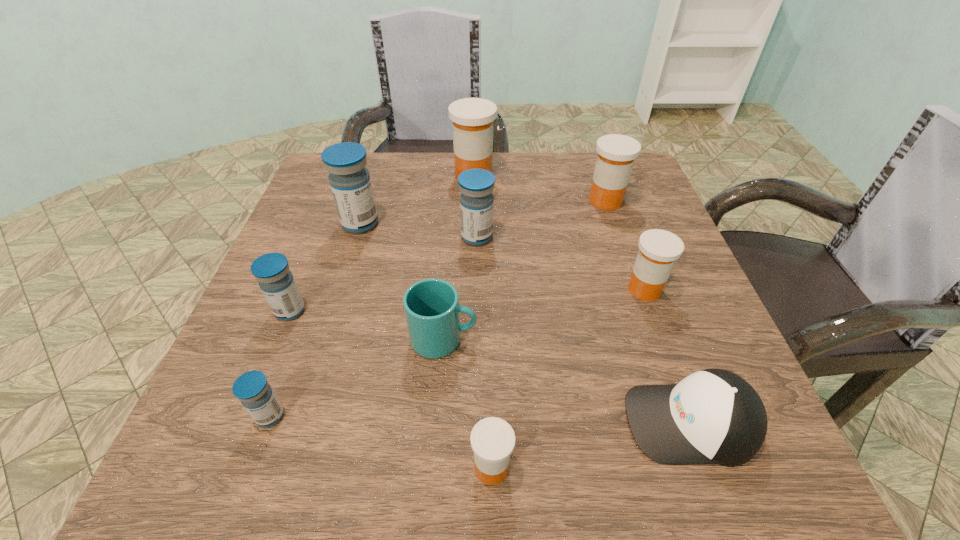
Image resolution: width=960 pixels, height=540 pixels. Find the location of `vacant space at the far left corner of the desktop`. vacant space at the far left corner of the desktop is located at coordinates (374, 176).

This screenshot has height=540, width=960. In the image, there is a desktop. Identify the location of vacant area at the near left corner. (239, 449).

Where is `free point at the far right corner`? This screenshot has height=540, width=960. free point at the far right corner is located at coordinates (589, 186).

Locate an element on the screen. The image size is (960, 540). vacant space at the near right corner of the desktop is located at coordinates (738, 467).

Where is `free space that is in between the third smallest orange medicine and the third smallest blue medicine`? This screenshot has height=540, width=960. free space that is in between the third smallest orange medicine and the third smallest blue medicine is located at coordinates (541, 219).

The width and height of the screenshot is (960, 540). In order to click on vacant space that is in between the second farthest orange medicine and the second biggest blue medicine in this screenshot , I will do `click(541, 219)`.

Where is `free space between the cup and the second nearest orange medicine`? free space between the cup and the second nearest orange medicine is located at coordinates (544, 314).

What are the coordinates of `vacant point located between the cup and the second smallest blue medicine` in the screenshot? It's located at pyautogui.click(x=367, y=325).

Locate an element on the screen. The height and width of the screenshot is (540, 960). vacant area that lies between the nearest blue medicine and the biggest blue medicine is located at coordinates (315, 320).

Locate an element on the screen. This screenshot has height=540, width=960. free point between the farthest object and the third smallest orange medicine is located at coordinates (540, 188).